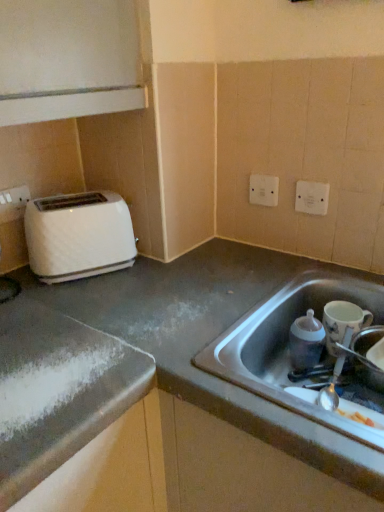
Question: Can you confirm if smooth gray countertop at lower right is taller than matte plastic baby bottle at sink, arranged as the third appliance when viewed from the right?

Choices:
 (A) no
 (B) yes

Answer: (B)

Question: From a real-world perspective, is smooth gray countertop at lower right below matte plastic baby bottle at sink, the first appliance in the left-to-right sequence?

Choices:
 (A) yes
 (B) no

Answer: (A)

Question: Does smooth gray countertop at lower right have a greater width compared to matte plastic baby bottle at sink, the first appliance in the left-to-right sequence?

Choices:
 (A) no
 (B) yes

Answer: (B)

Question: Is the depth of smooth gray countertop at lower right less than that of matte plastic baby bottle at sink, the first appliance in the left-to-right sequence?

Choices:
 (A) no
 (B) yes

Answer: (B)

Question: Is smooth gray countertop at lower right oriented towards matte plastic baby bottle at sink, the first appliance in the left-to-right sequence?

Choices:
 (A) no
 (B) yes

Answer: (A)

Question: In terms of size, does white plastic electric outlet at upper center, the 2th electric outlet viewed from the right, appear bigger or smaller than matte plastic baby bottle at sink, the first appliance in the left-to-right sequence?

Choices:
 (A) small
 (B) big

Answer: (A)

Question: Is white plastic electric outlet at upper center, the 2th electric outlet viewed from the right, taller or shorter than matte plastic baby bottle at sink, the first appliance in the left-to-right sequence?

Choices:
 (A) short
 (B) tall

Answer: (A)

Question: From the image's perspective, relative to matte plastic baby bottle at sink, the first appliance in the left-to-right sequence, is white plastic electric outlet at upper center, the 2th electric outlet viewed from the right, above or below?

Choices:
 (A) below
 (B) above

Answer: (B)

Question: In the image, is white plastic electric outlet at upper center, which is counted as the 1th electric outlet, starting from the left, positioned in front of or behind matte plastic baby bottle at sink, arranged as the third appliance when viewed from the right?

Choices:
 (A) behind
 (B) front

Answer: (A)

Question: From a real-world perspective, is white plastic electric outlet at upper right, the 2th electric outlet positioned from the back, positioned above or below white glossy mug at right, which ranks as the second appliance in right-to-left order?

Choices:
 (A) above
 (B) below

Answer: (A)

Question: Would you say white plastic electric outlet at upper right, acting as the second electric outlet starting from the left, is to the left or to the right of white glossy mug at right, which ranks as the second appliance in right-to-left order, in the picture?

Choices:
 (A) left
 (B) right

Answer: (A)

Question: In terms of width, does white plastic electric outlet at upper right, the first electric outlet from the right, look wider or thinner when compared to white glossy mug at right, placed as the 2th appliance when sorted from left to right?

Choices:
 (A) thin
 (B) wide

Answer: (A)

Question: From the image's perspective, is white plastic electric outlet at upper right, the 2th electric outlet positioned from the back, above or below white glossy mug at right, placed as the 2th appliance when sorted from left to right?

Choices:
 (A) above
 (B) below

Answer: (A)

Question: Is white plastic electric outlet at upper right, the 2th electric outlet positioned from the back, taller or shorter than matte plastic baby bottle at sink, the first appliance in the left-to-right sequence?

Choices:
 (A) short
 (B) tall

Answer: (A)

Question: Based on their sizes in the image, would you say white plastic electric outlet at upper right, acting as the second electric outlet starting from the left, is bigger or smaller than matte plastic baby bottle at sink, arranged as the third appliance when viewed from the right?

Choices:
 (A) big
 (B) small

Answer: (B)